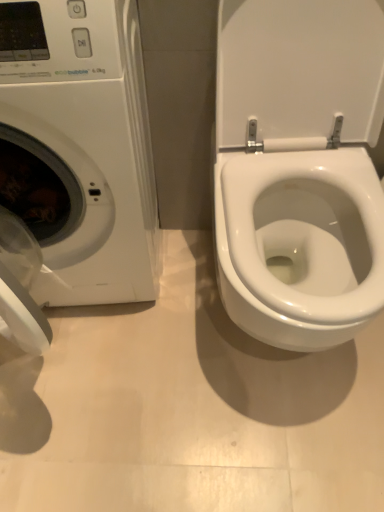
The height and width of the screenshot is (512, 384). Find the location of `white glossy washing machine at left`. white glossy washing machine at left is located at coordinates (75, 161).

Image resolution: width=384 pixels, height=512 pixels. What do you see at coordinates (75, 161) in the screenshot?
I see `white glossy washing machine at left` at bounding box center [75, 161].

What are the coordinates of `white glossy washing machine at left` in the screenshot? It's located at (75, 161).